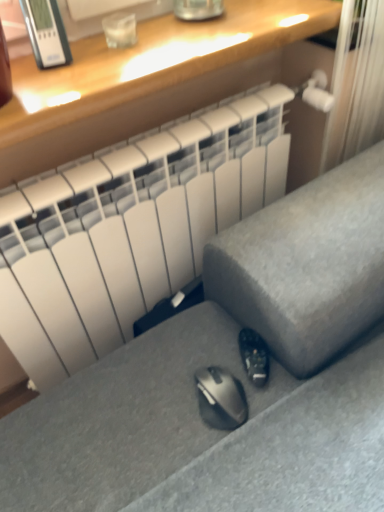
Question: From a real-world perspective, is satin gray sofa at lower center physically located above or below black matte shoe at lower center?

Choices:
 (A) below
 (B) above

Answer: (B)

Question: Considering their positions, is satin gray sofa at lower center located in front of or behind black matte shoe at lower center?

Choices:
 (A) front
 (B) behind

Answer: (A)

Question: Which object is positioned farthest from the satin gray sofa at lower center?

Choices:
 (A) black matte shoe at lower center
 (B) matte wood desk at upper center

Answer: (B)

Question: Which object is the farthest from the black matte shoe at lower center?

Choices:
 (A) matte wood desk at upper center
 (B) satin gray sofa at lower center

Answer: (A)